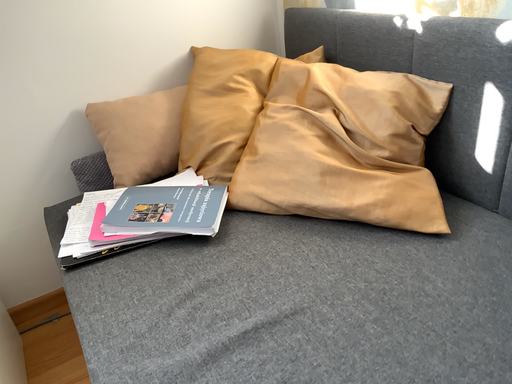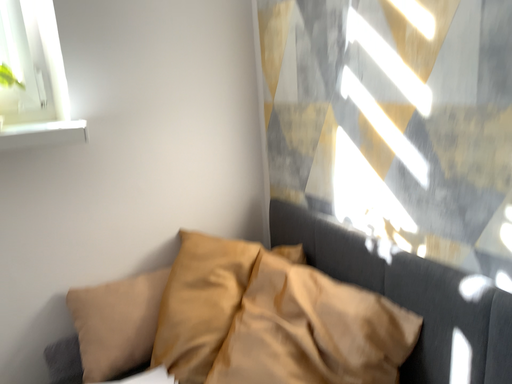
Question: How did the camera likely rotate when shooting the video?

Choices:
 (A) rotated upward
 (B) rotated downward

Answer: (A)